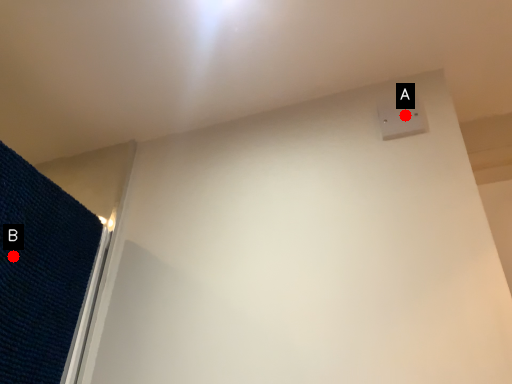
Question: Two points are circled on the image, labeled by A and B beside each circle. Among these points, which one is farthest from the camera?

Choices:
 (A) A is further
 (B) B is further

Answer: (A)